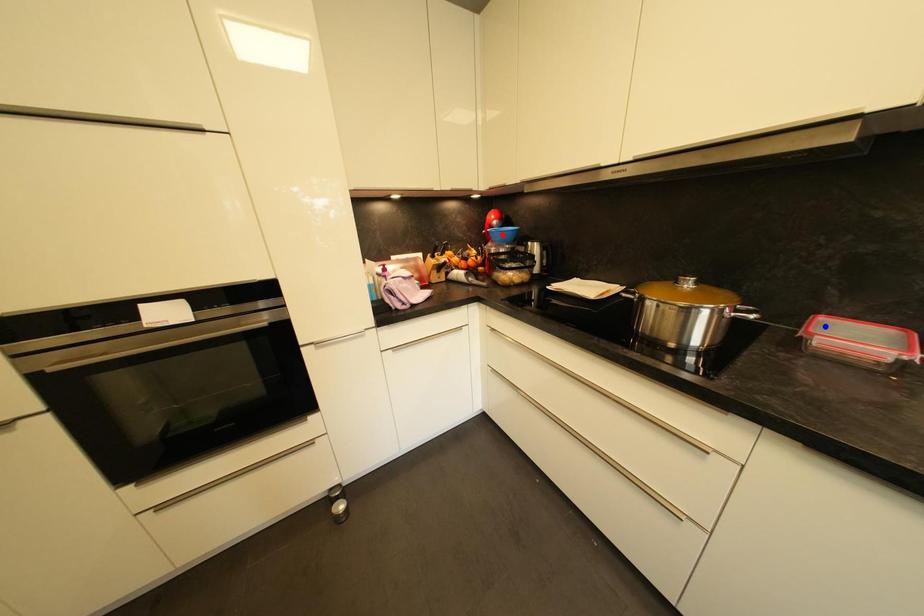
Question: Which of the two points in the image is closer to the camera?

Choices:
 (A) Blue point is closer.
 (B) Red point is closer.

Answer: (A)